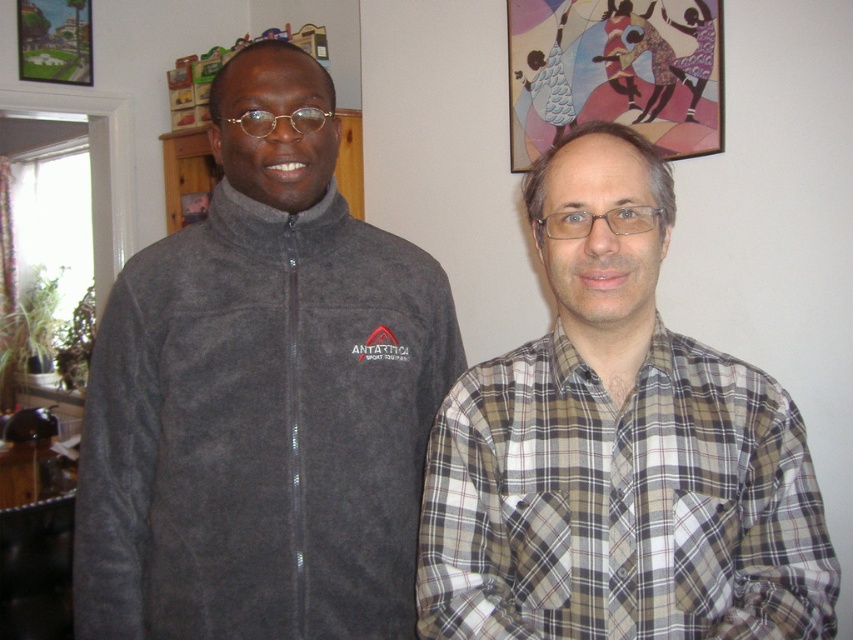
You are an interior designer analyzing the placement of objects in the image. The dark gray fleece jacket at left is positioned at coordinates 0.620, 0.308. If you were to place a decorative plaque measuring 0.15 units in width and 0.1 units in height at the same location, would it overlap with the jacket?

The decorative plaque would overlap with the dark gray fleece jacket at left because it is placed at the same coordinates.

You are a delivery person who needs to place a package at point (262,396). The package is 0.1 meters wide. Is there enough space at that point?

The dark gray fleece jacket at left is located at point (262,396). Since the package is 0.1 meters wide and the space at that point is occupied by the jacket, there is not enough space to place the package there.

You are standing in the room and want to move from the point at coordinates point (129, 428) to the point at coordinates point (738, 563). Can you walk directly between them without any obstacles?

The point at coordinates point (129, 428) is behind point (738, 563), so you cannot walk directly between them without obstacles.